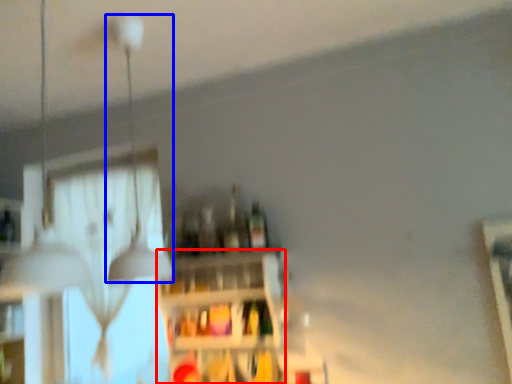
Question: Which object appears closest to the camera in this image, shelf (highlighted by a red box) or lamp (highlighted by a blue box)?

Choices:
 (A) shelf
 (B) lamp

Answer: (B)